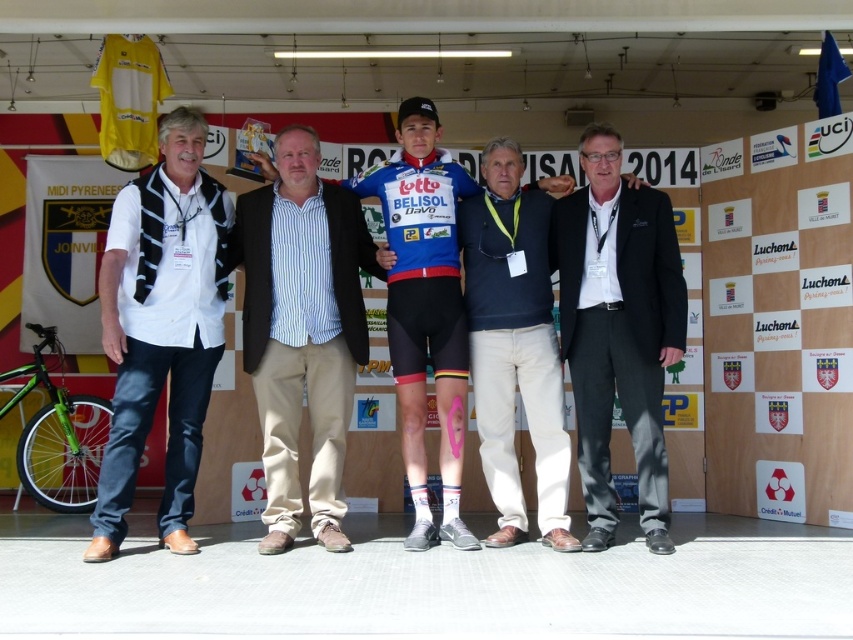
Question: Which object appears closest to the camera in this image?

Choices:
 (A) white cotton shirt at left
 (B) dark blue cotton shirt at center
 (C) black suit at center

Answer: (A)

Question: Can you confirm if striped cotton shirt at center is positioned to the right of dark blue cotton shirt at center?

Choices:
 (A) no
 (B) yes

Answer: (A)

Question: Is dark blue cotton shirt at center closer to the viewer compared to blue jersey at center?

Choices:
 (A) no
 (B) yes

Answer: (B)

Question: Does striped cotton shirt at center have a larger size compared to black suit at center?

Choices:
 (A) yes
 (B) no

Answer: (A)

Question: Which is nearer to the black suit at center?

Choices:
 (A) dark blue cotton shirt at center
 (B) blue jersey at center

Answer: (A)

Question: Which is nearer to the black suit at center?

Choices:
 (A) striped cotton shirt at center
 (B) dark blue cotton shirt at center

Answer: (B)